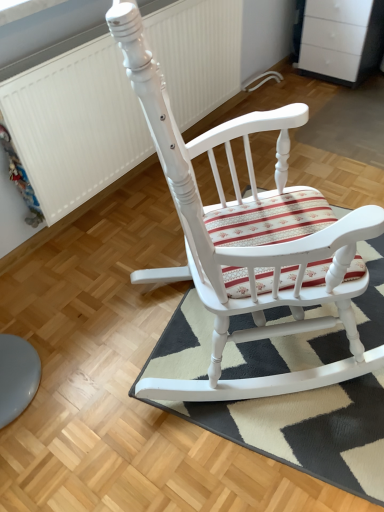
Question: From the image's perspective, is striped fabric doormat at center positioned above or below white textured radiator at upper left?

Choices:
 (A) below
 (B) above

Answer: (A)

Question: Is striped fabric doormat at center to the left or to the right of white textured radiator at upper left in the image?

Choices:
 (A) right
 (B) left

Answer: (A)

Question: Based on their relative distances, which object is farther from the white textured radiator at upper left?

Choices:
 (A) white painted wood rocking chair at center
 (B) striped fabric doormat at center

Answer: (B)

Question: Based on their relative distances, which object is farther from the striped fabric doormat at center?

Choices:
 (A) white textured radiator at upper left
 (B) white painted wood rocking chair at center

Answer: (A)